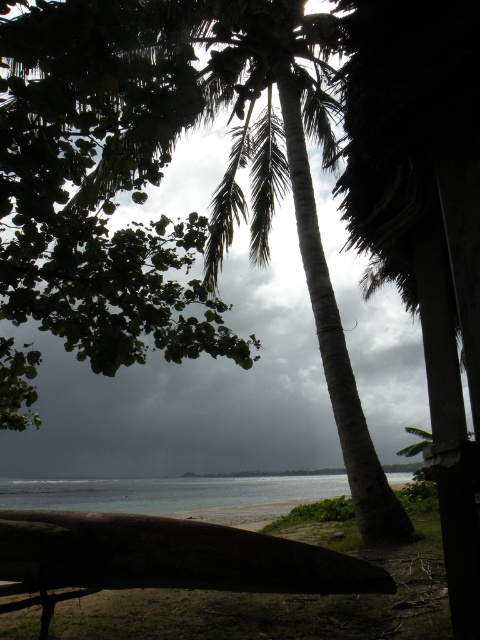
Question: Does green textured palm tree at center appear on the left side of clear water at lower center?

Choices:
 (A) yes
 (B) no

Answer: (B)

Question: Can you confirm if green textured palm tree at center is positioned to the right of clear water at lower center?

Choices:
 (A) yes
 (B) no

Answer: (A)

Question: Is green textured palm tree at center in front of clear water at lower center?

Choices:
 (A) yes
 (B) no

Answer: (A)

Question: Among these points, which one is nearest to the camera?

Choices:
 (A) (212, 262)
 (B) (271, 504)

Answer: (A)

Question: Which point is closer to the camera?

Choices:
 (A) green textured palm tree at center
 (B) clear water at lower center

Answer: (A)